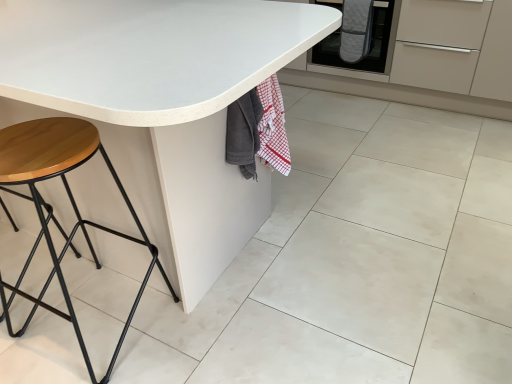
Question: Does white matte granite at center lie in front of quilted gray oven mitts at center?

Choices:
 (A) no
 (B) yes

Answer: (B)

Question: Considering the relative sizes of white matte granite at center and quilted gray oven mitts at center in the image provided, is white matte granite at center wider than quilted gray oven mitts at center?

Choices:
 (A) no
 (B) yes

Answer: (B)

Question: Does white matte granite at center touch quilted gray oven mitts at center?

Choices:
 (A) yes
 (B) no

Answer: (B)

Question: Is white matte granite at center positioned beyond the bounds of quilted gray oven mitts at center?

Choices:
 (A) yes
 (B) no

Answer: (A)

Question: Is white matte granite at center oriented away from quilted gray oven mitts at center?

Choices:
 (A) no
 (B) yes

Answer: (A)

Question: From the image's perspective, is quilted gray oven mitts at center positioned above or below wooden/matte stool at left?

Choices:
 (A) above
 (B) below

Answer: (A)

Question: In terms of size, does quilted gray oven mitts at center appear bigger or smaller than wooden/matte stool at left?

Choices:
 (A) small
 (B) big

Answer: (B)

Question: Would you say quilted gray oven mitts at center is inside or outside wooden/matte stool at left?

Choices:
 (A) outside
 (B) inside

Answer: (A)

Question: Considering their positions, is quilted gray oven mitts at center located in front of or behind wooden/matte stool at left?

Choices:
 (A) front
 (B) behind

Answer: (B)

Question: Is wooden/matte stool at left in front of or behind white matte table at center in the image?

Choices:
 (A) behind
 (B) front

Answer: (A)

Question: Considering the positions of point (173, 296) and point (31, 21), is point (173, 296) closer or farther from the camera than point (31, 21)?

Choices:
 (A) closer
 (B) farther

Answer: (B)

Question: From a real-world perspective, is wooden/matte stool at left positioned above or below white matte table at center?

Choices:
 (A) below
 (B) above

Answer: (A)

Question: In terms of width, does wooden/matte stool at left look wider or thinner when compared to white matte table at center?

Choices:
 (A) wide
 (B) thin

Answer: (B)

Question: From the image's perspective, is white matte table at center located above or below white matte granite at center?

Choices:
 (A) above
 (B) below

Answer: (A)

Question: In terms of width, does white matte table at center look wider or thinner when compared to white matte granite at center?

Choices:
 (A) wide
 (B) thin

Answer: (A)